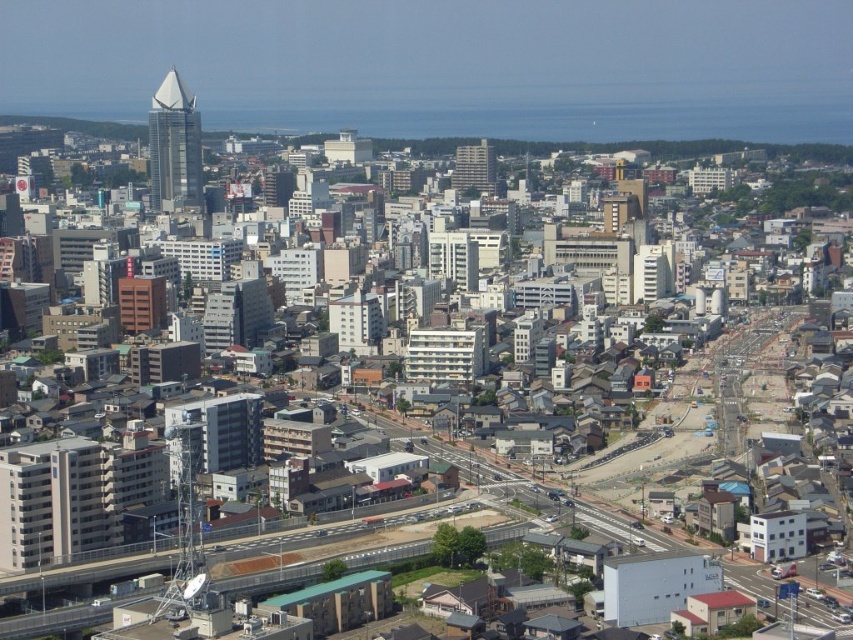
Question: Which point is closer to the camera?

Choices:
 (A) matte glass spire at upper left
 (B) shiny glass skyscraper at upper left

Answer: (B)

Question: In this image, where is shiny glass skyscraper at upper left located relative to matte glass spire at upper left?

Choices:
 (A) below
 (B) above

Answer: (A)

Question: Is shiny glass skyscraper at upper left closer to the viewer compared to matte glass spire at upper left?

Choices:
 (A) no
 (B) yes

Answer: (B)

Question: Can you confirm if shiny glass skyscraper at upper left is wider than matte glass spire at upper left?

Choices:
 (A) no
 (B) yes

Answer: (B)

Question: Which point is closer to the camera?

Choices:
 (A) (196, 138)
 (B) (186, 90)

Answer: (A)